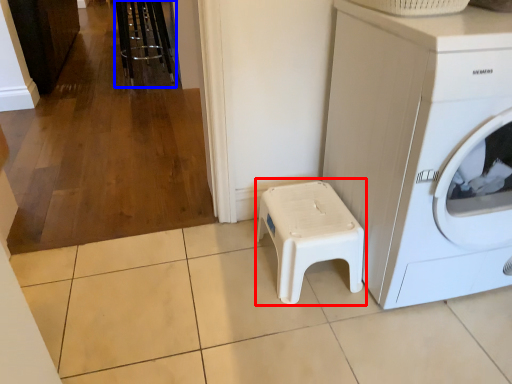
Question: Which of the following is the closest to the observer, music stool (highlighted by a red box) or bar stool (highlighted by a blue box)?

Choices:
 (A) music stool
 (B) bar stool

Answer: (A)